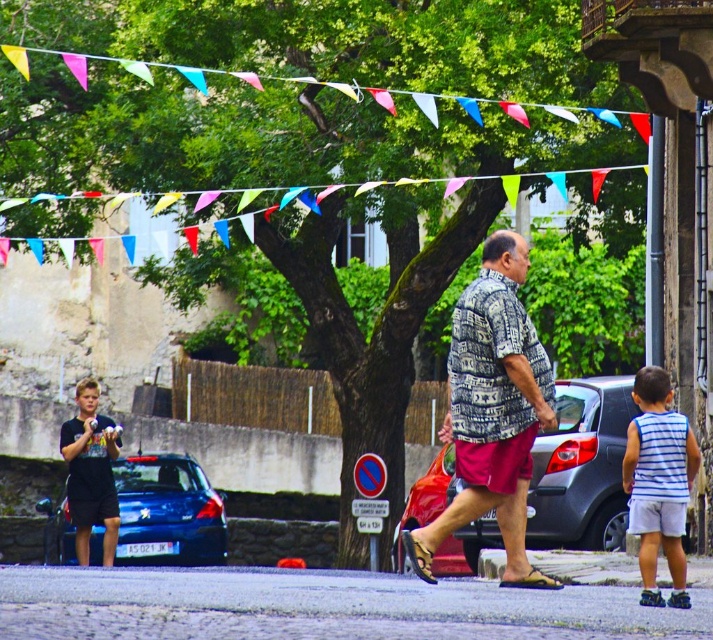
You are a photographer trying to capture both the printed cotton shirt at center and the shiny red car at center in a single frame. Which object should you focus on first to ensure both are in the frame?

The printed cotton shirt at center is larger than the shiny red car at center, so you should focus on the printed cotton shirt at center first to ensure both fit within the frame.

You are planning to park your car in the parking lot behind the shiny red car at center and the shiny blue car at lower left. Which car should you park next to if you want to maximize the available space between your car and the other vehicles?

You should park next to the shiny red car at center because its width is smaller than the shiny blue car at lower left, allowing for more space between your car and the other vehicles.